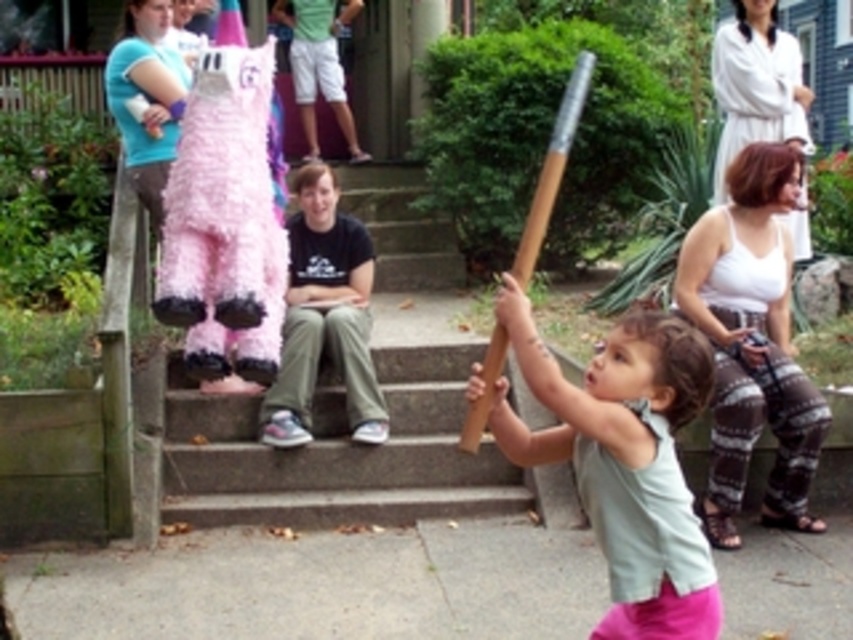
Is the position of light green fabric shirt at center less distant than that of brown wooden bat at center?

Yes, it is.

Can you confirm if light green fabric shirt at center is positioned below brown wooden bat at center?

Yes.

Who is more forward, (674, 360) or (520, 252)?

Positioned in front is point (674, 360).

Where is `light green fabric shirt at center`? This screenshot has height=640, width=853. light green fabric shirt at center is located at coordinates (624, 461).

Between point (544, 440) and point (157, 211), which one is positioned in front?

Positioned in front is point (544, 440).

Does light green fabric shirt at center have a greater width compared to matte pink piñata at upper left?

Indeed, light green fabric shirt at center has a greater width compared to matte pink piñata at upper left.

What are the coordinates of `light green fabric shirt at center` in the screenshot? It's located at (624, 461).

I want to click on light green fabric shirt at center, so click(x=624, y=461).

Find the location of a particular element. The image size is (853, 640). matte pink piñata at upper left is located at coordinates 146,99.

What do you see at coordinates (146, 99) in the screenshot? The width and height of the screenshot is (853, 640). I see `matte pink piñata at upper left` at bounding box center [146, 99].

Is point (178, 80) farther from viewer compared to point (541, 241)?

Yes, point (178, 80) is farther from viewer.

Find the location of a particular element. This screenshot has width=853, height=640. matte pink piñata at upper left is located at coordinates (146, 99).